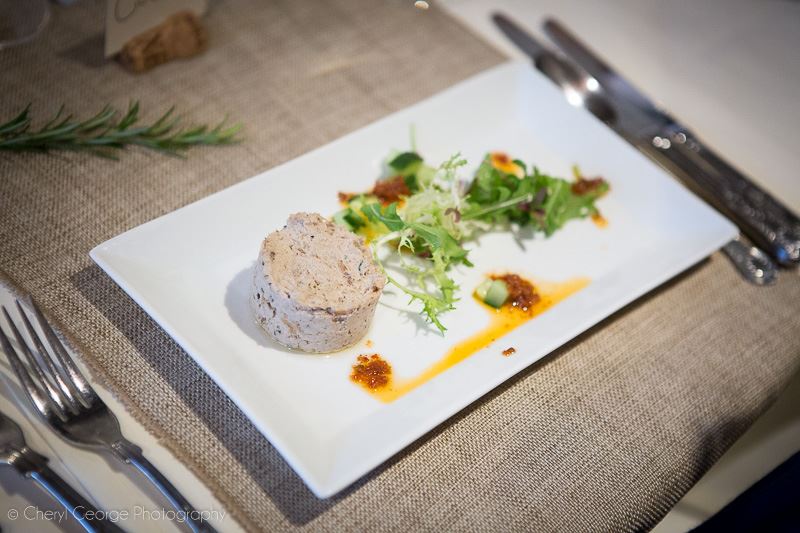
The width and height of the screenshot is (800, 533). I want to click on silver handles of utensils, so point(790,219), point(776,237), point(753,260), point(201,529), point(105,530).